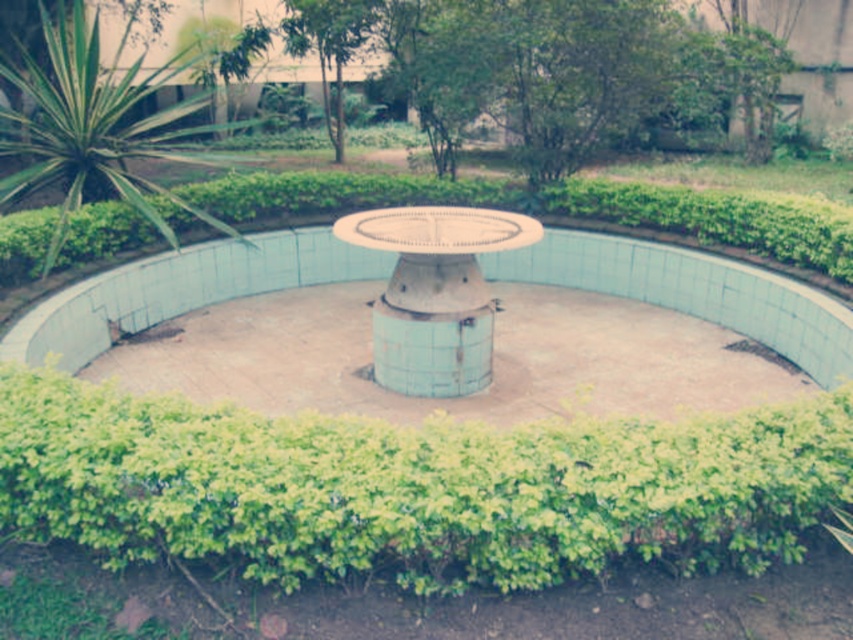
Question: Is green leafy hedge at lower center positioned behind blue metallic water feature at center?

Choices:
 (A) no
 (B) yes

Answer: (A)

Question: Which point is closer to the camera?

Choices:
 (A) (309, 406)
 (B) (129, 93)
 (C) (486, 288)
 (D) (212, 429)

Answer: (D)

Question: Which is farther from the green leafy bush at left?

Choices:
 (A) blue metallic water feature at center
 (B) green leafy hedge at lower center
 (C) blue concrete pool at center

Answer: (B)

Question: Which point is closer to the camera taking this photo?

Choices:
 (A) (480, 346)
 (B) (111, 394)
 (C) (811, 371)
 (D) (152, 140)

Answer: (B)

Question: Can you confirm if blue concrete pool at center is positioned above blue metallic water feature at center?

Choices:
 (A) no
 (B) yes

Answer: (A)

Question: In this image, where is green leafy hedge at lower center located relative to blue concrete pool at center?

Choices:
 (A) below
 (B) above

Answer: (A)